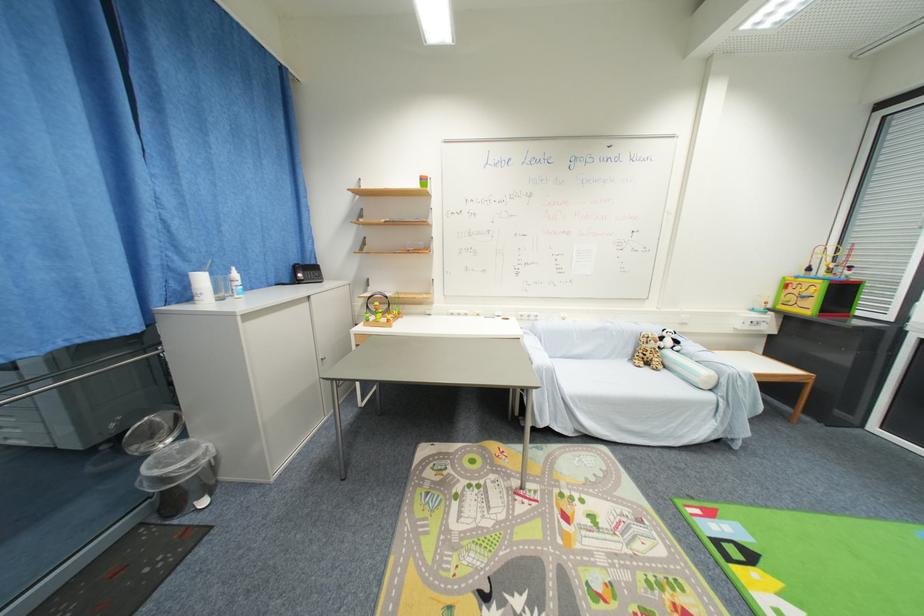
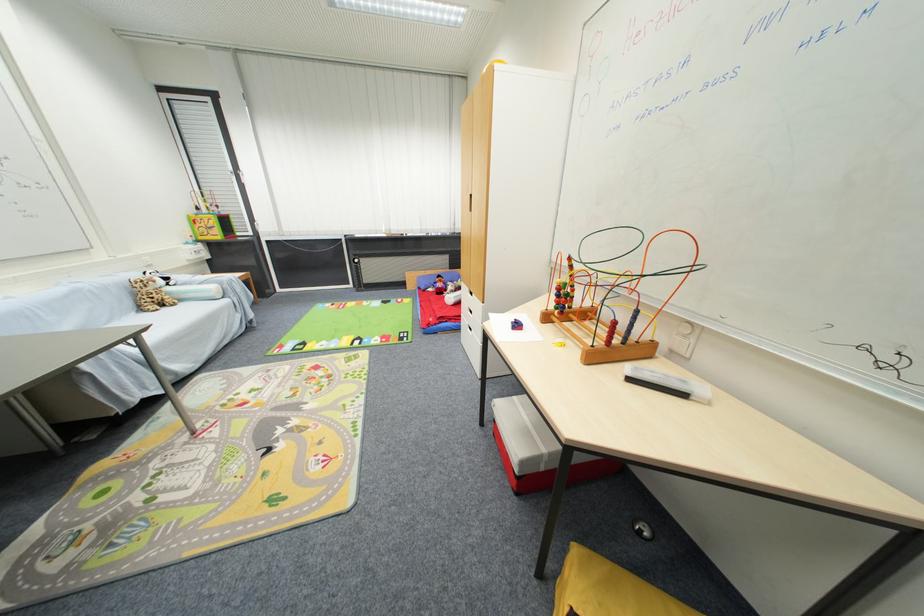
Locate, in the second image, the point that corresponds to (x=760, y=317) in the first image.

(198, 249)